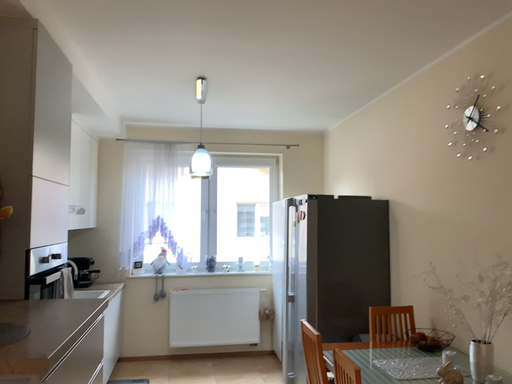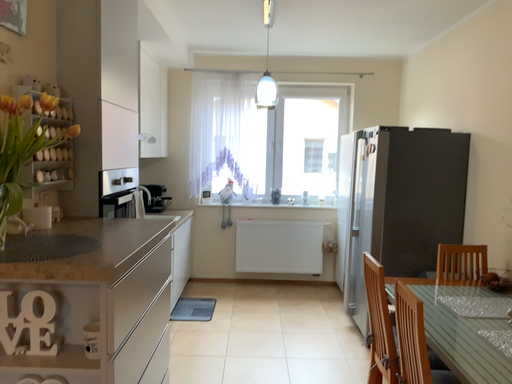
Question: Which way did the camera rotate in the video?

Choices:
 (A) rotated right
 (B) rotated left

Answer: (B)